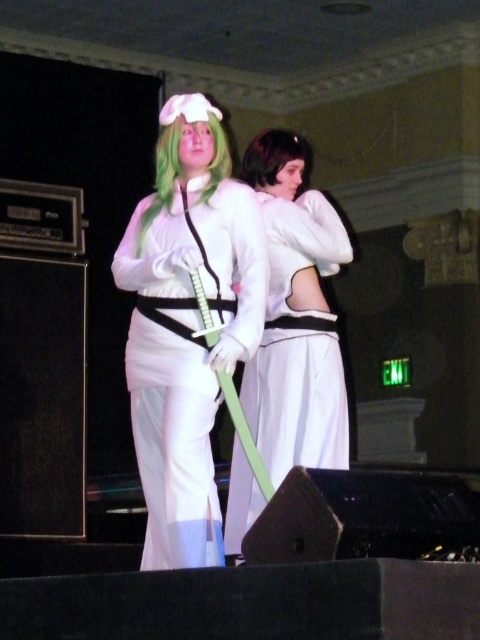
This screenshot has width=480, height=640. Describe the element at coordinates (188, 324) in the screenshot. I see `white matte cosplay outfit at center` at that location.

Who is more forward, (208,380) or (282,157)?

Positioned in front is point (208,380).

Identify the location of white matte cosplay outfit at center. This screenshot has height=640, width=480. (188, 324).

Can you confirm if white matte cosplay outfit at center is thinner than white matte/soft fabric dress at center?

No, white matte cosplay outfit at center is not thinner than white matte/soft fabric dress at center.

Is white matte cosplay outfit at center in front of white matte/soft fabric dress at center?

Yes, it is in front of white matte/soft fabric dress at center.

Between point (158, 516) and point (313, 429), which one is positioned in front?

Point (158, 516)

The width and height of the screenshot is (480, 640). I want to click on white matte cosplay outfit at center, so click(188, 324).

Which of these two, white matte/soft fabric dress at center or black matte hair at upper center, stands shorter?

black matte hair at upper center

Is white matte/soft fabric dress at center below black matte hair at upper center?

Indeed, white matte/soft fabric dress at center is positioned under black matte hair at upper center.

Is point (290, 189) positioned behind point (262, 150)?

Yes, point (290, 189) is farther from viewer.

The image size is (480, 640). Identify the location of white matte/soft fabric dress at center. (296, 316).